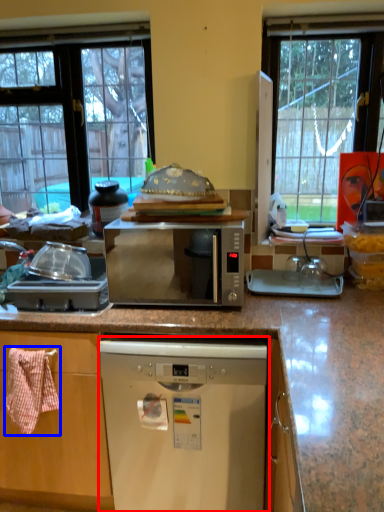
Question: Which point is closer to the camera, dishwasher (highlighted by a red box) or material (highlighted by a blue box)?

Choices:
 (A) dishwasher
 (B) material

Answer: (A)